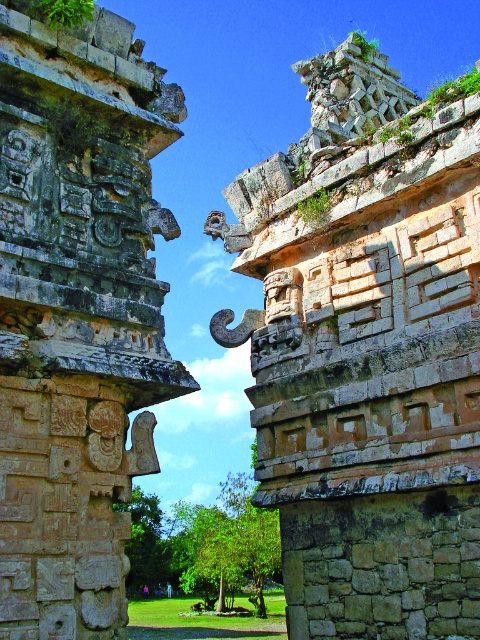
Question: Is weathered stone ruins at upper right below gray stone carvings at left?

Choices:
 (A) yes
 (B) no

Answer: (B)

Question: Which point is closer to the camera?

Choices:
 (A) (326, 561)
 (B) (100, 324)

Answer: (B)

Question: Does weathered stone ruins at upper right have a lesser width compared to gray stone carvings at left?

Choices:
 (A) yes
 (B) no

Answer: (B)

Question: Can you confirm if weathered stone ruins at upper right is wider than gray stone carvings at left?

Choices:
 (A) no
 (B) yes

Answer: (B)